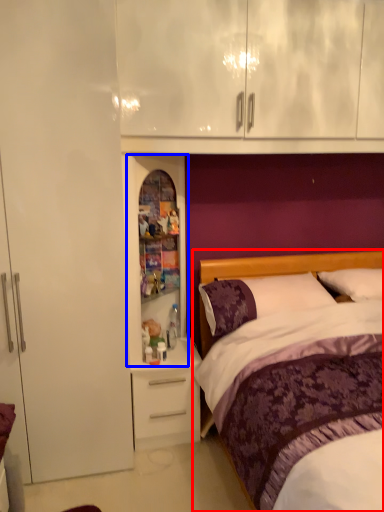
Question: Which object is closer to the camera taking this photo, bed (highlighted by a red box) or medicine cabinet (highlighted by a blue box)?

Choices:
 (A) bed
 (B) medicine cabinet

Answer: (A)